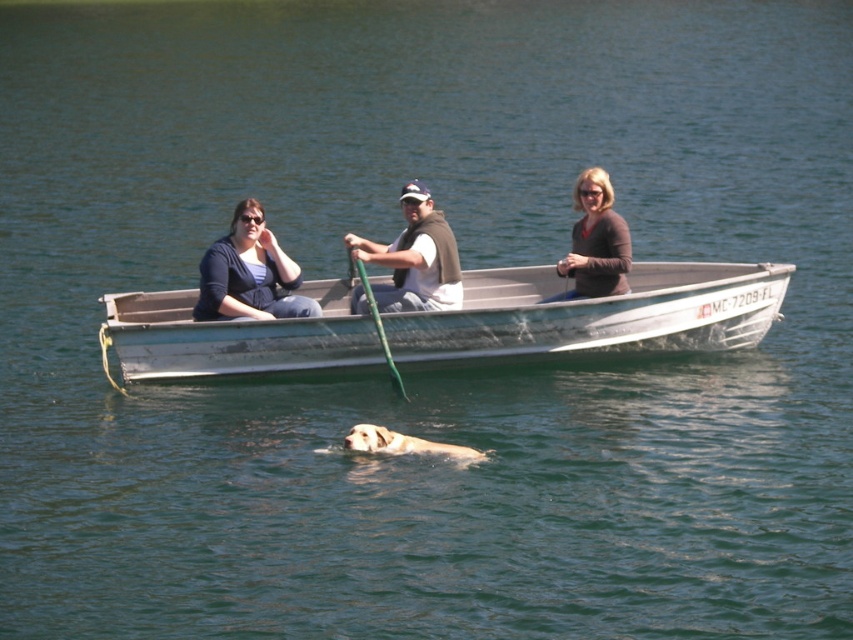
Question: Which object is the farthest from the white cotton shirt at center?

Choices:
 (A) matte brown sweater at center
 (B) metallic gray boat at center

Answer: (B)

Question: Can you confirm if metallic gray boat at center is bigger than matte black sweater at left?

Choices:
 (A) yes
 (B) no

Answer: (B)

Question: Which of these objects is positioned closest to the white cotton shirt at center?

Choices:
 (A) metallic gray boat at center
 (B) matte brown sweater at center
 (C) matte black sweater at left

Answer: (C)

Question: Is metallic gray boat at center closer to the viewer compared to light brown fur dog at center?

Choices:
 (A) yes
 (B) no

Answer: (B)

Question: Which point appears farthest from the camera in this image?

Choices:
 (A) (287, 355)
 (B) (364, 436)
 (C) (453, 244)

Answer: (C)

Question: Is matte brown sweater at center in front of light brown fur dog at center?

Choices:
 (A) no
 (B) yes

Answer: (A)